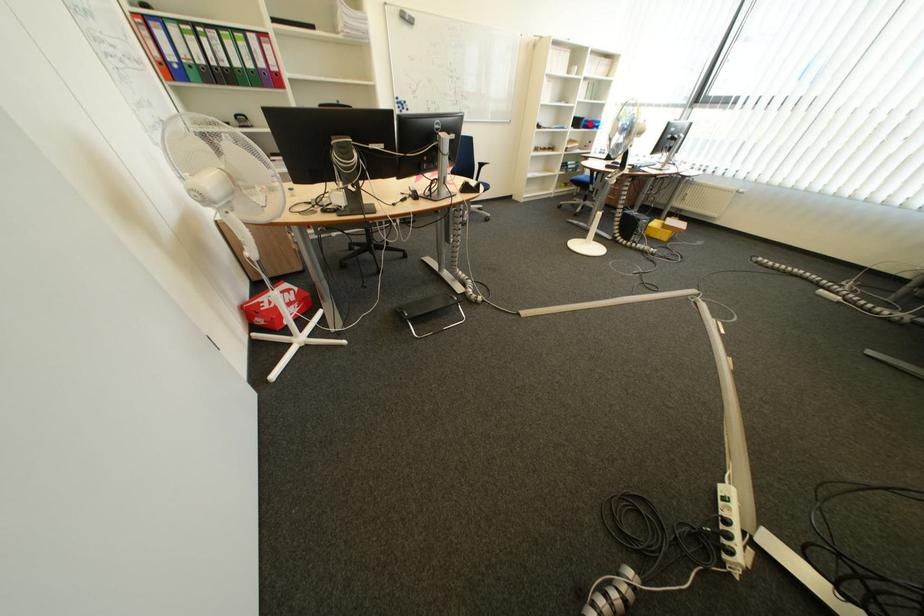
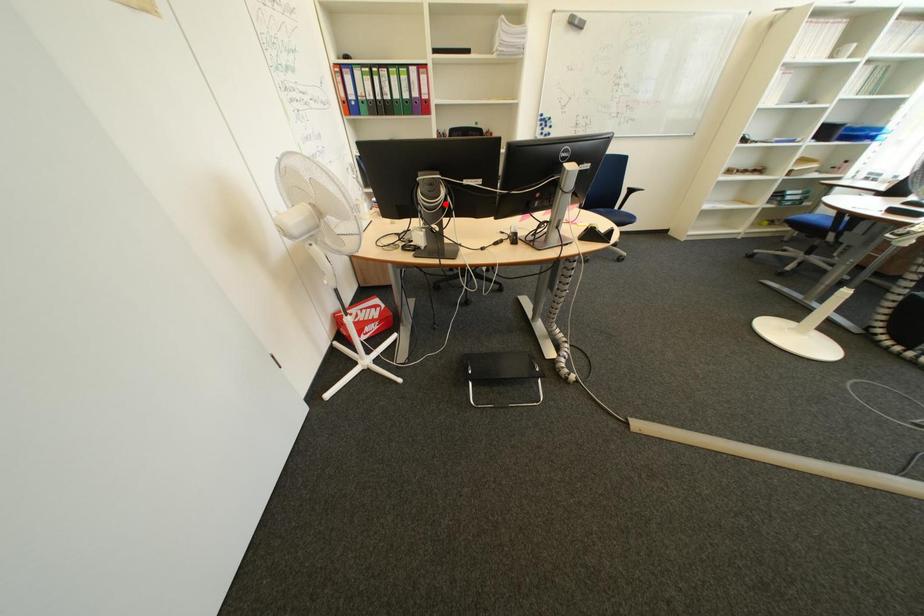
I am providing you with two images of the same scene from different viewpoints. A red point is marked on the first image and another point is marked on the second image. Is the red point in image1 aligned with the point shown in image2?

No